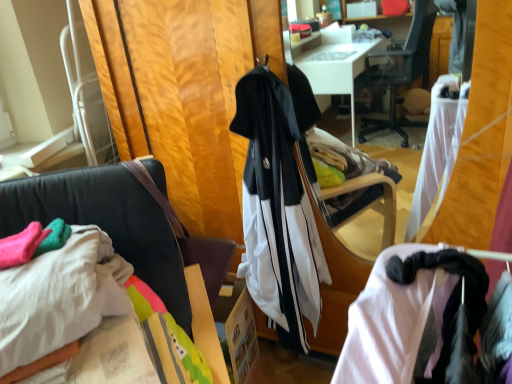
Question: Can you confirm if white cotton sheet at lower left is positioned to the left of velvet black chair at center?

Choices:
 (A) yes
 (B) no

Answer: (A)

Question: Is the depth of white cotton sheet at lower left less than that of velvet black chair at center?

Choices:
 (A) no
 (B) yes

Answer: (A)

Question: Is white cotton sheet at lower left not close to velvet black chair at center?

Choices:
 (A) yes
 (B) no

Answer: (B)

Question: Considering the relative sizes of white cotton sheet at lower left and velvet black chair at center in the image provided, is white cotton sheet at lower left smaller than velvet black chair at center?

Choices:
 (A) yes
 (B) no

Answer: (A)

Question: Considering the relative sizes of white cotton sheet at lower left and velvet black chair at center in the image provided, is white cotton sheet at lower left shorter than velvet black chair at center?

Choices:
 (A) yes
 (B) no

Answer: (A)

Question: Is white matte tracksuit at center spatially inside velvet black chair at center, or outside of it?

Choices:
 (A) inside
 (B) outside

Answer: (B)

Question: Considering the positions of white matte tracksuit at center and velvet black chair at center in the image, is white matte tracksuit at center bigger or smaller than velvet black chair at center?

Choices:
 (A) big
 (B) small

Answer: (B)

Question: Is white matte tracksuit at center wider or thinner than velvet black chair at center?

Choices:
 (A) thin
 (B) wide

Answer: (A)

Question: Considering the positions of point (258, 185) and point (90, 170), is point (258, 185) closer or farther from the camera than point (90, 170)?

Choices:
 (A) farther
 (B) closer

Answer: (A)

Question: Based on their positions, is white cotton sheet at lower left located to the left or right of white matte tracksuit at center?

Choices:
 (A) left
 (B) right

Answer: (A)

Question: From a real-world perspective, is white cotton sheet at lower left positioned above or below white matte tracksuit at center?

Choices:
 (A) below
 (B) above

Answer: (B)

Question: Is white cotton sheet at lower left in front of or behind white matte tracksuit at center in the image?

Choices:
 (A) front
 (B) behind

Answer: (A)

Question: Is point (116, 286) closer or farther from the camera than point (266, 114)?

Choices:
 (A) closer
 (B) farther

Answer: (A)

Question: From a real-world perspective, relative to velvet black chair at center, is white cotton sheet at lower left vertically above or below?

Choices:
 (A) above
 (B) below

Answer: (A)

Question: Which is correct: white cotton sheet at lower left is inside velvet black chair at center, or outside of it?

Choices:
 (A) outside
 (B) inside

Answer: (B)